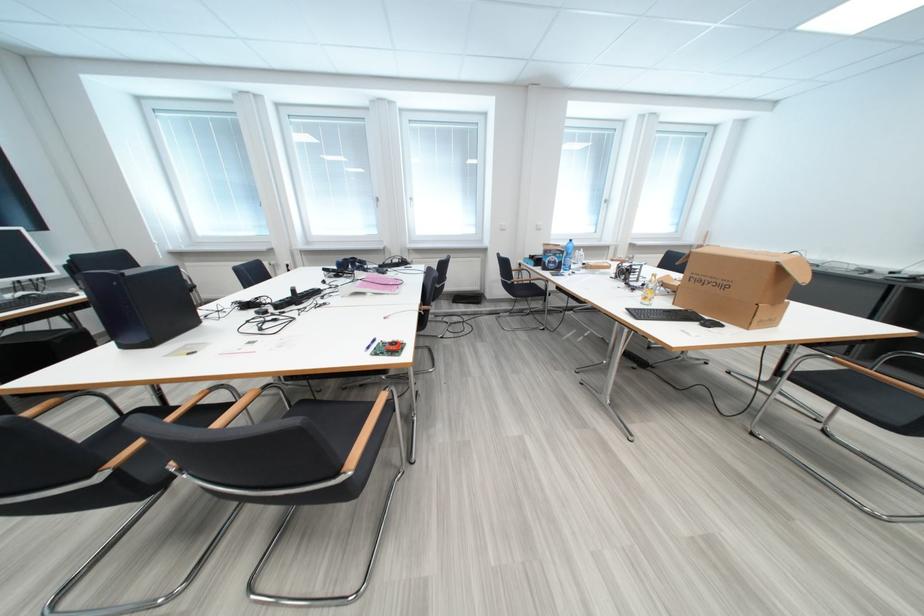
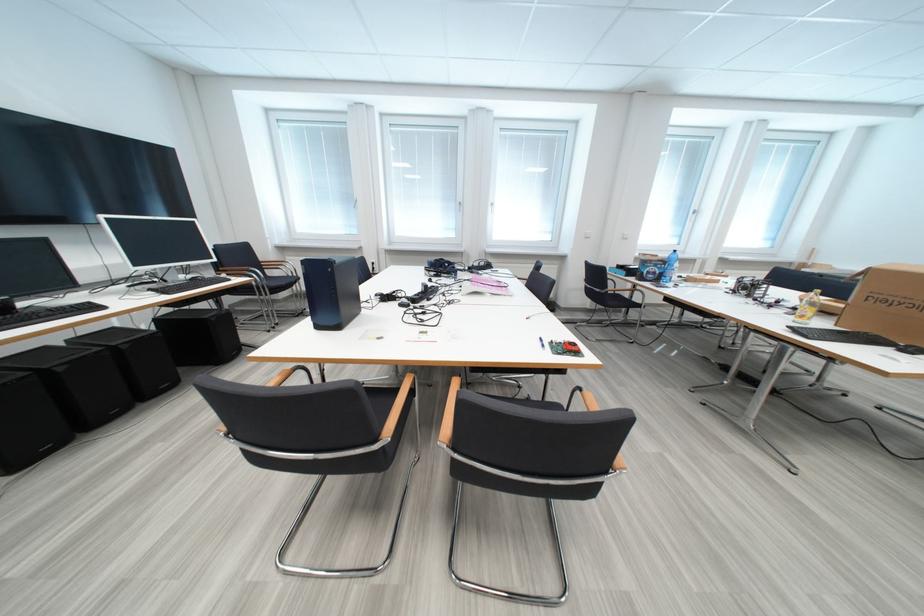
Locate, in the second image, the point that corresponds to (x=136, y=349) in the first image.

(329, 330)